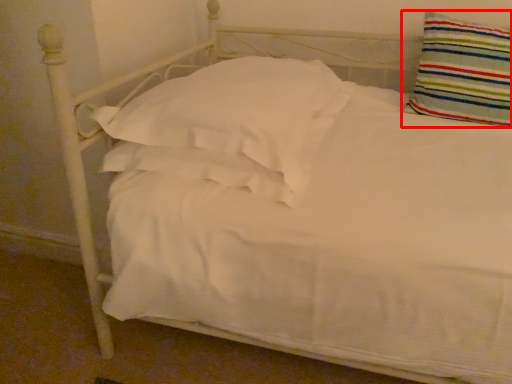
Question: From the image's perspective, considering the relative positions of pillow (annotated by the red box) and pillow in the image provided, where is pillow (annotated by the red box) located with respect to the staircase?

Choices:
 (A) above
 (B) below

Answer: (A)